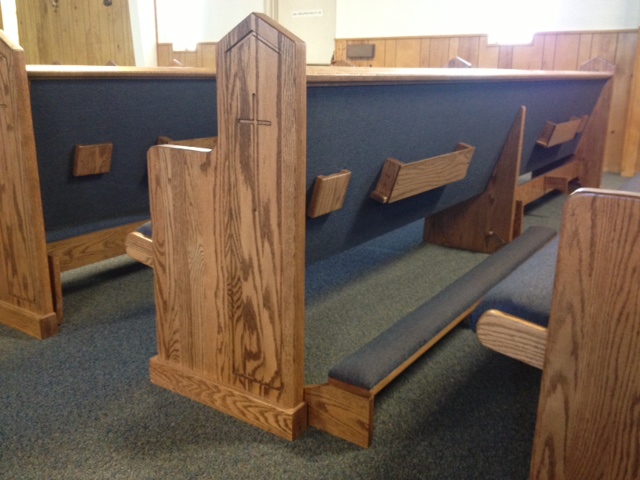
Locate an element on the screen. The height and width of the screenshot is (480, 640). seat cusion is located at coordinates (529, 278).